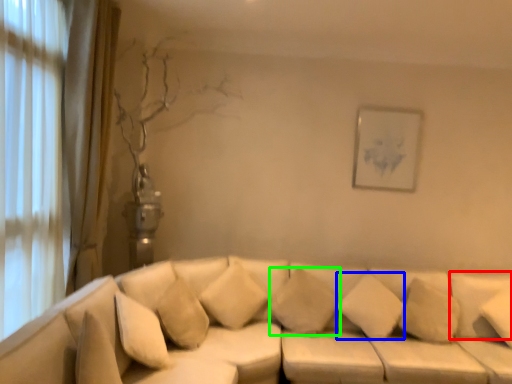
Question: Based on their relative distances, which object is farther from pillow (highlighted by a red box)? Choose from pillow (highlighted by a blue box) and pillow (highlighted by a green box).

Choices:
 (A) pillow
 (B) pillow

Answer: (B)